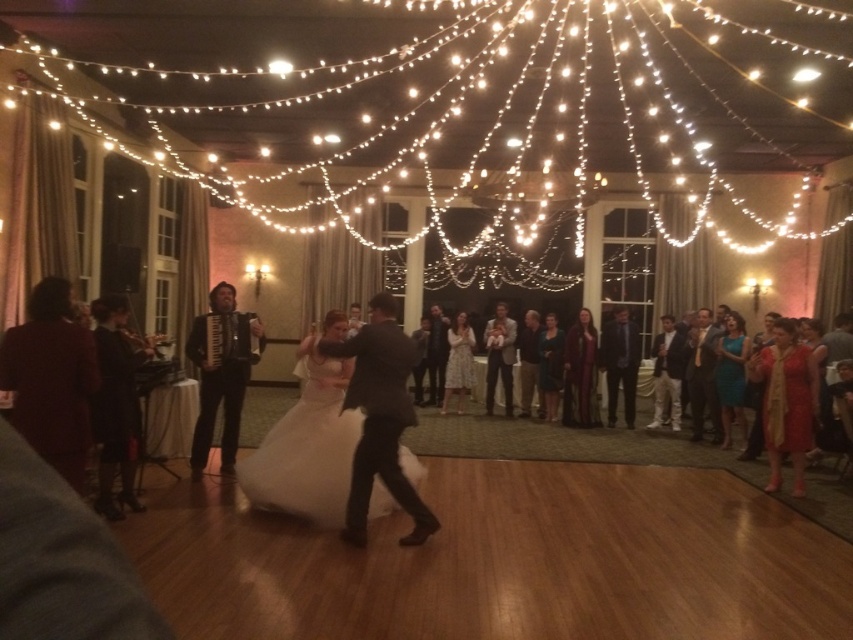
Question: Based on their relative distances, which object is farther from the white satin dress at center?

Choices:
 (A) white floral dress at center
 (B) black leather accordion at center

Answer: (A)

Question: Is white satin dress at center in front of white floral dress at center?

Choices:
 (A) yes
 (B) no

Answer: (A)

Question: Which point is farther to the camera?

Choices:
 (A) white satin dress at center
 (B) black leather accordion at center

Answer: (B)

Question: From the image, what is the correct spatial relationship of white satin dress at center in relation to black leather accordion at center?

Choices:
 (A) left
 (B) right

Answer: (B)

Question: Can you confirm if white satin dress at center is wider than black leather accordion at center?

Choices:
 (A) no
 (B) yes

Answer: (B)

Question: Among these objects, which one is farthest from the camera?

Choices:
 (A) white floral dress at center
 (B) black leather accordion at center

Answer: (A)